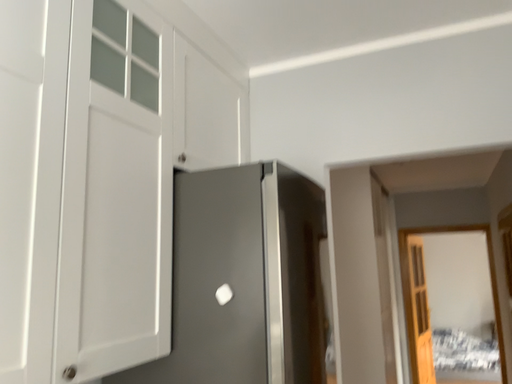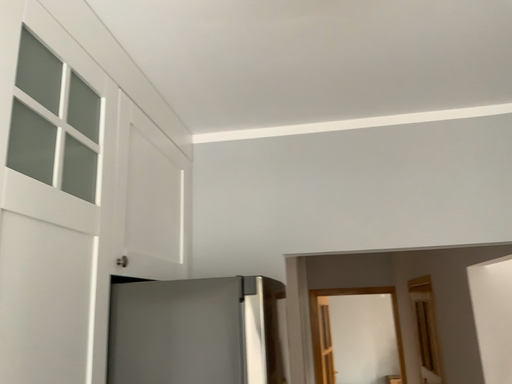
Question: Which way did the camera rotate in the video?

Choices:
 (A) rotated right
 (B) rotated left

Answer: (A)